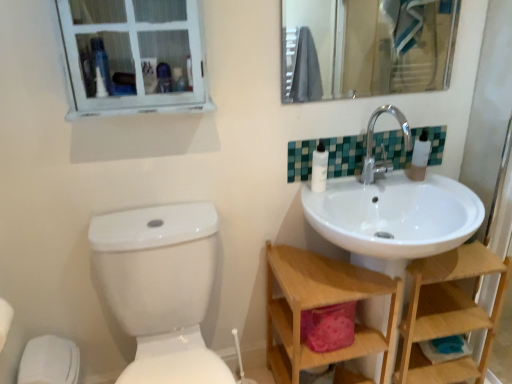
Question: Is wooden at right, the second shelf positioned from the left, closer to camera compared to wooden shelf at lower right, the second shelf viewed from the right?

Choices:
 (A) yes
 (B) no

Answer: (B)

Question: Is wooden shelf at lower right, the second shelf viewed from the right, at the back of wooden at right, the 1th shelf positioned from the right?

Choices:
 (A) yes
 (B) no

Answer: (B)

Question: Is wooden at right, the 1th shelf positioned from the right, aimed at wooden shelf at lower right, the second shelf viewed from the right?

Choices:
 (A) no
 (B) yes

Answer: (A)

Question: Does wooden at right, the 1th shelf positioned from the right, have a lesser width compared to wooden shelf at lower right, placed as the 1th shelf when sorted from left to right?

Choices:
 (A) yes
 (B) no

Answer: (A)

Question: From a real-world perspective, is wooden at right, the 1th shelf positioned from the right, under wooden shelf at lower right, the second shelf viewed from the right?

Choices:
 (A) yes
 (B) no

Answer: (A)

Question: Would you say wooden at right, the 1th shelf positioned from the right, is to the left or to the right of white plastic bottles at upper right in the picture?

Choices:
 (A) left
 (B) right

Answer: (B)

Question: From a real-world perspective, relative to white plastic bottles at upper right, is wooden at right, the second shelf positioned from the left, vertically above or below?

Choices:
 (A) above
 (B) below

Answer: (B)

Question: Considering their positions, is wooden at right, the 1th shelf positioned from the right, located in front of or behind white plastic bottles at upper right?

Choices:
 (A) front
 (B) behind

Answer: (A)

Question: Considering the positions of wooden at right, the 1th shelf positioned from the right, and white plastic bottles at upper right in the image, is wooden at right, the 1th shelf positioned from the right, wider or thinner than white plastic bottles at upper right?

Choices:
 (A) thin
 (B) wide

Answer: (B)

Question: From the image's perspective, is white wooden window at upper left positioned above or below wooden at right, the 1th shelf positioned from the right?

Choices:
 (A) above
 (B) below

Answer: (A)

Question: Is white wooden window at upper left to the left or to the right of wooden at right, the second shelf positioned from the left, in the image?

Choices:
 (A) left
 (B) right

Answer: (A)

Question: Looking at their shapes, would you say white wooden window at upper left is wider or thinner than wooden at right, the second shelf positioned from the left?

Choices:
 (A) thin
 (B) wide

Answer: (A)

Question: In terms of height, does white wooden window at upper left look taller or shorter compared to wooden at right, the second shelf positioned from the left?

Choices:
 (A) tall
 (B) short

Answer: (B)

Question: In terms of size, does chrome metallic faucet at upper right appear bigger or smaller than teal mosaic tiles at upper right?

Choices:
 (A) big
 (B) small

Answer: (A)

Question: From a real-world perspective, is chrome metallic faucet at upper right physically located above or below teal mosaic tiles at upper right?

Choices:
 (A) below
 (B) above

Answer: (B)